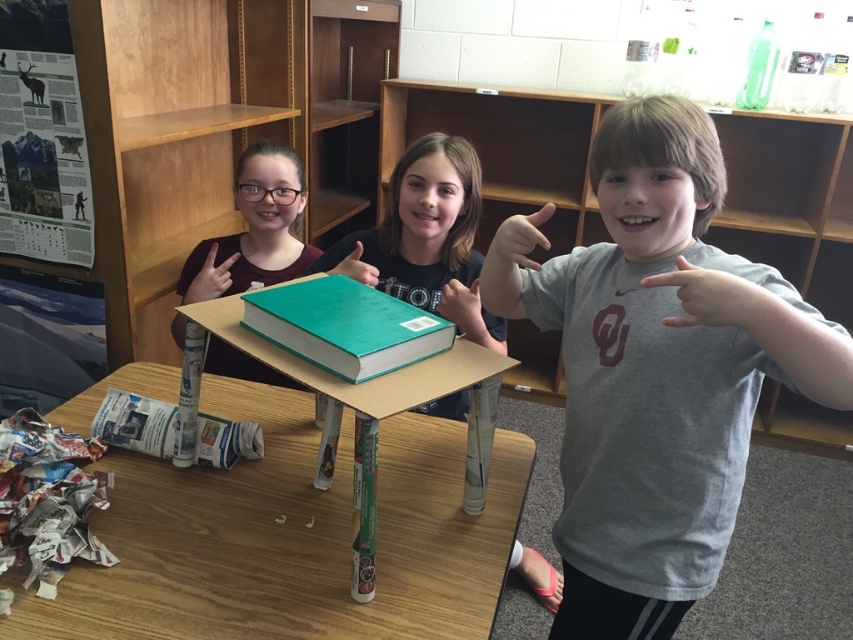
Which is in front, point (831, 342) or point (520, 257)?

Point (831, 342) is more forward.

Between gray cotton t-shirt at center and matte gray finger at upper right, which one is positioned lower?

gray cotton t-shirt at center is lower down.

Is point (625, 225) positioned after point (515, 220)?

Yes.

Where is `gray cotton t-shirt at center`? The height and width of the screenshot is (640, 853). gray cotton t-shirt at center is located at coordinates (659, 380).

Is green hardcover book at center smaller than matte black hand at upper left?

No.

Who is more distant from viewer, (347, 326) or (210, 246)?

The point (210, 246) is behind.

The width and height of the screenshot is (853, 640). What are the coordinates of `green hardcover book at center` in the screenshot? It's located at (345, 326).

The height and width of the screenshot is (640, 853). What do you see at coordinates (659, 380) in the screenshot? I see `gray cotton t-shirt at center` at bounding box center [659, 380].

Which of these two, gray cotton t-shirt at center or green matte book at center, stands shorter?

With less height is green matte book at center.

Is point (643, 509) behind point (334, 273)?

No, it is not.

Where is `gray cotton t-shirt at center`? The height and width of the screenshot is (640, 853). gray cotton t-shirt at center is located at coordinates (659, 380).